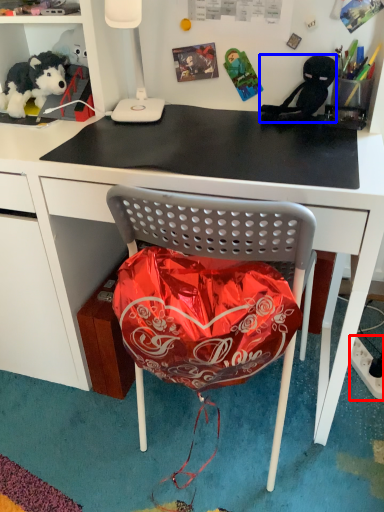
Question: Which object appears farthest to the camera in this image, power outlet (highlighted by a red box) or person (highlighted by a blue box)?

Choices:
 (A) power outlet
 (B) person

Answer: (A)